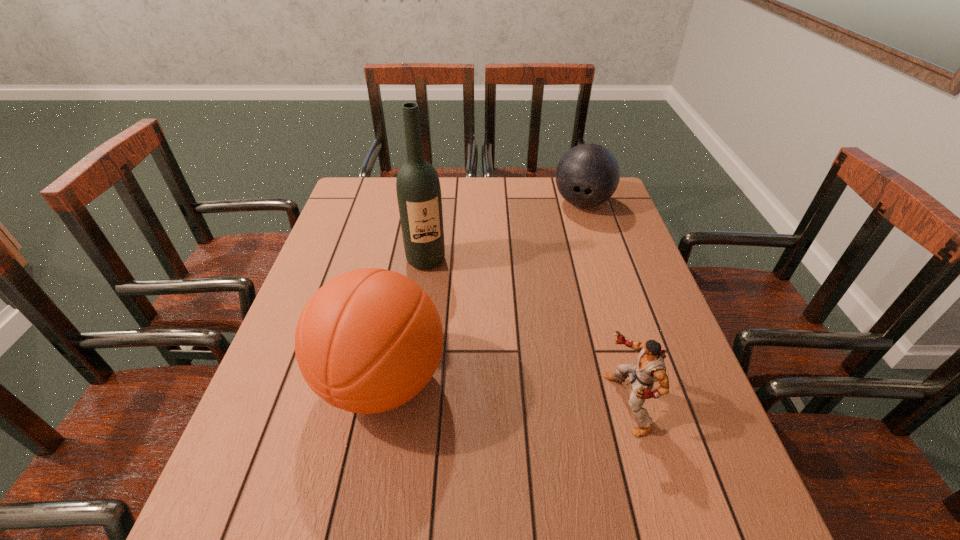
Locate an element on the screen. vacant space on the desktop that is between the third shortest object and the puncher and is positioned on the grip area of the farthest object is located at coordinates (525, 394).

Find the location of `free space on the desktop that is between the third shortest object and the puncher and is positioned on the labeled side of the tallest object`. free space on the desktop that is between the third shortest object and the puncher and is positioned on the labeled side of the tallest object is located at coordinates (473, 389).